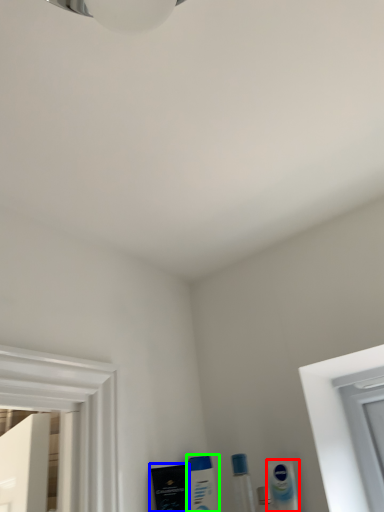
Question: Which object is the farthest from mouthwash (highlighted by a red box)? Choose among these: mouthwash (highlighted by a blue box) or mouthwash (highlighted by a green box).

Choices:
 (A) mouthwash
 (B) mouthwash

Answer: (A)